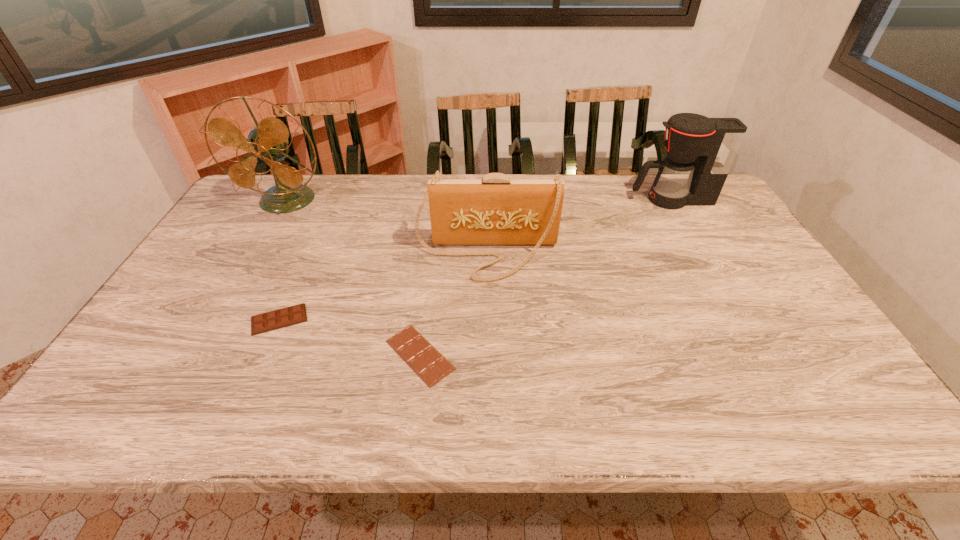
Locate an element on the screen. The width and height of the screenshot is (960, 540). fan is located at coordinates (268, 140).

Locate an element on the screen. Image resolution: width=960 pixels, height=540 pixels. the rightmost object is located at coordinates (700, 151).

This screenshot has width=960, height=540. Identify the location of coffee maker. (700, 151).

Locate an element on the screen. This screenshot has height=540, width=960. handbag is located at coordinates (495, 210).

Locate an element on the screen. The width and height of the screenshot is (960, 540). the third tallest object is located at coordinates (495, 210).

Image resolution: width=960 pixels, height=540 pixels. What are the coordinates of `the fourth tallest object` in the screenshot? It's located at (273, 320).

At what (x,y) coordinates should I click in order to perform the action: click on the left chocolate bar. Please return your answer as a coordinate pair (x, y). The image size is (960, 540). Looking at the image, I should click on (273, 320).

Find the location of a particular element. The image size is (960, 540). the right chocolate bar is located at coordinates (431, 366).

At what (x,y) coordinates should I click in order to perform the action: click on the shorter chocolate bar. Please return your answer as a coordinate pair (x, y). Looking at the image, I should click on (431, 366).

Find the location of `vacant space situated 0.180m in front of the fan, directing air flow`. vacant space situated 0.180m in front of the fan, directing air flow is located at coordinates (255, 253).